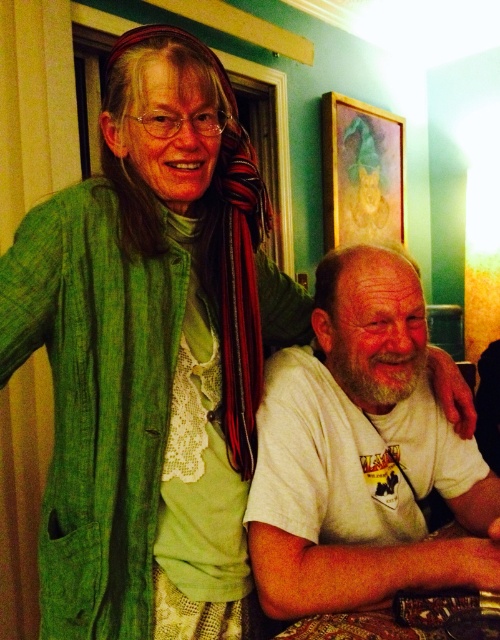
Who is higher up, white cotton t-shirt at center or wooden frame at upper center?

wooden frame at upper center is higher up.

Which is more to the right, white cotton t-shirt at center or wooden frame at upper center?

wooden frame at upper center

Between point (384, 595) and point (372, 188), which one is positioned in front?

Point (384, 595) is more forward.

You are a GUI agent. You are given a task and a screenshot of the screen. Output one action in this format:
    pyautogui.click(x=<x>, y=<y>)
    Task: Click on the white cotton t-shirt at center
    The image size is (500, 640).
    Given the screenshot: What is the action you would take?
    pyautogui.click(x=362, y=456)